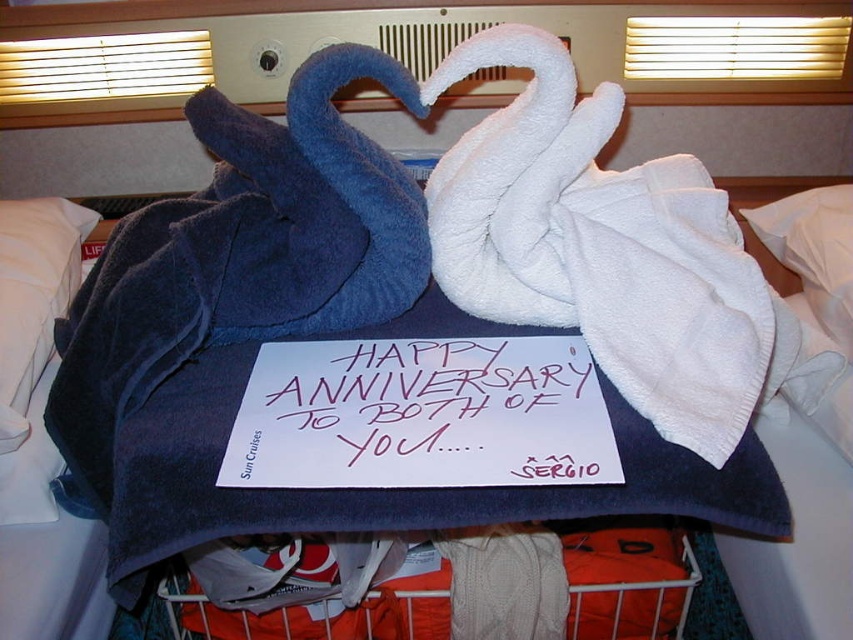
Question: Which object is closer to the camera taking this photo?

Choices:
 (A) white soft pillow at left
 (B) white soft pillow at upper center

Answer: (A)

Question: Does orange fabric basket at lower center have a smaller size compared to white soft pillow at left?

Choices:
 (A) no
 (B) yes

Answer: (B)

Question: Which object is the farthest from the white paper at center?

Choices:
 (A) white soft pillow at upper center
 (B) orange fabric basket at lower center
 (C) white soft pillow at left

Answer: (A)

Question: Is orange fabric basket at lower center wider than white soft pillow at left?

Choices:
 (A) yes
 (B) no

Answer: (A)

Question: Is white paper at center closer to camera compared to white soft pillow at left?

Choices:
 (A) yes
 (B) no

Answer: (A)

Question: Which object appears closest to the camera in this image?

Choices:
 (A) white soft pillow at left
 (B) white paper at center
 (C) white soft pillow at upper center
 (D) orange fabric basket at lower center

Answer: (B)